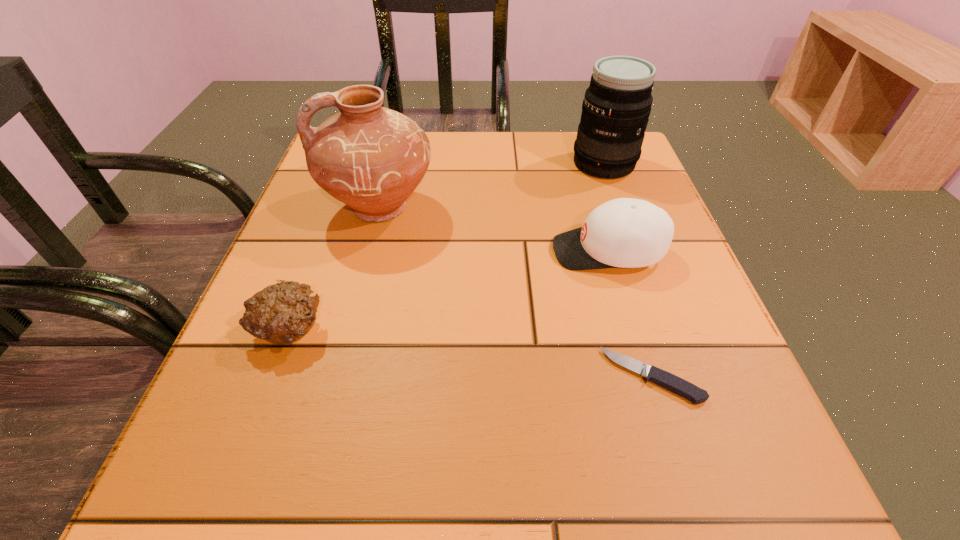
The height and width of the screenshot is (540, 960). Find the location of `blank region between the pottery and the telephoto lens`. blank region between the pottery and the telephoto lens is located at coordinates (492, 186).

The width and height of the screenshot is (960, 540). I want to click on free space between the pottery and the fourth tallest object, so click(x=335, y=269).

Locate an element on the screen. free space that is in between the fourth tallest object and the telephoto lens is located at coordinates (446, 246).

Where is `empty space between the fourth tallest object and the telephoto lens`? Image resolution: width=960 pixels, height=540 pixels. empty space between the fourth tallest object and the telephoto lens is located at coordinates (446, 246).

Identify the location of empty location between the pottery and the shortest object. (516, 292).

At what (x,y) coordinates should I click in order to perform the action: click on free space between the steak knife and the pottery. Please return your answer as a coordinate pair (x, y). The width and height of the screenshot is (960, 540). Looking at the image, I should click on (516, 292).

This screenshot has height=540, width=960. I want to click on object that is the closest to the baseball cap, so click(x=669, y=381).

The height and width of the screenshot is (540, 960). I want to click on object that can be found as the third closest to the telephoto lens, so click(x=669, y=381).

This screenshot has width=960, height=540. What are the coordinates of `free space that satisfies the following two spatial constraints: 1. on the side of the pottery with the handle; 2. on the left side of the telephoto lens` in the screenshot? It's located at (392, 164).

Locate an element on the screen. The image size is (960, 540). free spot that satisfies the following two spatial constraints: 1. on the side of the pottery with the handle; 2. on the right side of the telephoto lens is located at coordinates (392, 164).